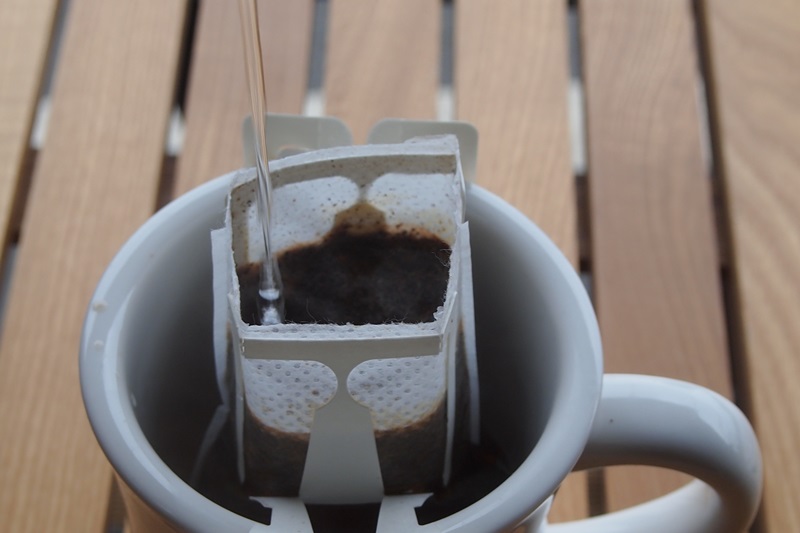
Find the location of a particular element. Image resolution: width=800 pixels, height=533 pixels. holes in between the planks is located at coordinates (710, 111), (577, 113), (449, 106), (312, 91), (180, 100), (42, 93).